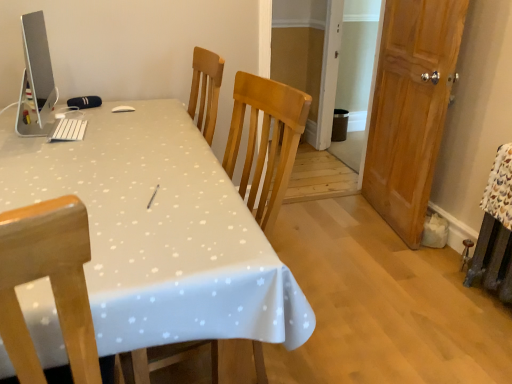
Question: Considering the relative sizes of wooden door at right and sleek silver monitor at upper left in the image provided, is wooden door at right wider than sleek silver monitor at upper left?

Choices:
 (A) no
 (B) yes

Answer: (B)

Question: Is wooden door at right positioned before sleek silver monitor at upper left?

Choices:
 (A) no
 (B) yes

Answer: (A)

Question: Can you confirm if wooden door at right is taller than sleek silver monitor at upper left?

Choices:
 (A) yes
 (B) no

Answer: (A)

Question: Is the surface of wooden door at right in direct contact with sleek silver monitor at upper left?

Choices:
 (A) yes
 (B) no

Answer: (B)

Question: Is wooden door at right not close to sleek silver monitor at upper left?

Choices:
 (A) no
 (B) yes

Answer: (B)

Question: Is wooden door at right wider or thinner than sleek silver monitor at upper left?

Choices:
 (A) wide
 (B) thin

Answer: (A)

Question: Based on their sizes in the image, would you say wooden door at right is bigger or smaller than sleek silver monitor at upper left?

Choices:
 (A) big
 (B) small

Answer: (A)

Question: Considering the positions of point (375, 155) and point (32, 13), is point (375, 155) closer or farther from the camera than point (32, 13)?

Choices:
 (A) farther
 (B) closer

Answer: (A)

Question: Would you say wooden door at right is to the left or to the right of sleek silver monitor at upper left in the picture?

Choices:
 (A) left
 (B) right

Answer: (B)

Question: Considering their positions, is white glossy table at center located in front of or behind sleek silver monitor at upper left?

Choices:
 (A) front
 (B) behind

Answer: (A)

Question: Is point coord(155,210) closer or farther from the camera than point coord(22,110)?

Choices:
 (A) closer
 (B) farther

Answer: (A)

Question: Choose the correct answer: Is white glossy table at center inside sleek silver monitor at upper left or outside it?

Choices:
 (A) outside
 (B) inside

Answer: (A)

Question: From the image's perspective, relative to sleek silver monitor at upper left, is white glossy table at center above or below?

Choices:
 (A) below
 (B) above

Answer: (A)

Question: From the image's perspective, is sleek silver monitor at upper left above or below wooden door at right?

Choices:
 (A) below
 (B) above

Answer: (B)

Question: Choose the correct answer: Is sleek silver monitor at upper left inside wooden door at right or outside it?

Choices:
 (A) inside
 (B) outside

Answer: (B)